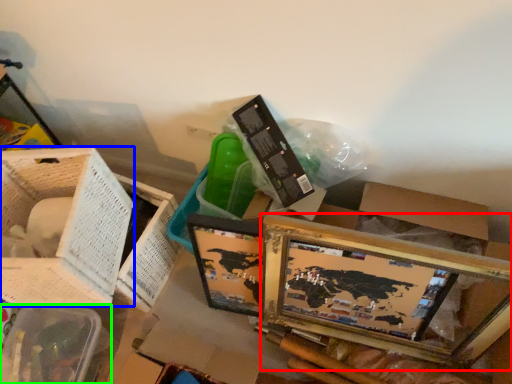
Question: Which object is the closest to the picture frame (highlighted by a red box)? Choose among these: basket (highlighted by a blue box) or basket (highlighted by a green box).

Choices:
 (A) basket
 (B) basket

Answer: (A)